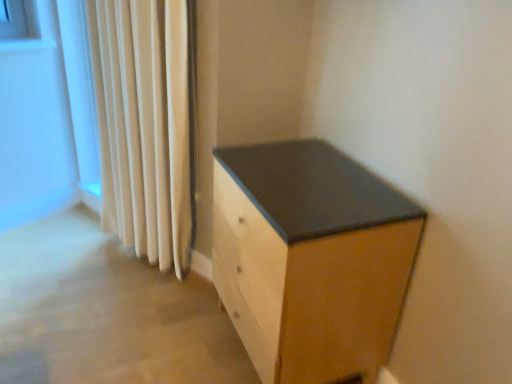
The image size is (512, 384). In order to click on beige fabric curtain at left in this screenshot , I will do 145,125.

This screenshot has width=512, height=384. What do you see at coordinates (145, 125) in the screenshot?
I see `beige fabric curtain at left` at bounding box center [145, 125].

In order to face matte black drawer at center, should I rotate leftwards or rightwards?

You should rotate right by 5.571 degrees.

The height and width of the screenshot is (384, 512). I want to click on matte black drawer at center, so point(311,259).

What do you see at coordinates (311, 259) in the screenshot? I see `matte black drawer at center` at bounding box center [311, 259].

Find the location of a particular element. The height and width of the screenshot is (384, 512). beige fabric curtain at left is located at coordinates (145, 125).

Does beige fabric curtain at left appear on the right side of matte black drawer at center?

In fact, beige fabric curtain at left is to the left of matte black drawer at center.

Between beige fabric curtain at left and matte black drawer at center, which one is positioned in front?

matte black drawer at center is closer to the camera.

Does point (139, 139) come in front of point (324, 167)?

No, it is not.

From the image's perspective, which one is positioned higher, beige fabric curtain at left or matte black drawer at center?

beige fabric curtain at left appears higher in the image.

From a real-world perspective, is beige fabric curtain at left positioned above or below matte black drawer at center?

beige fabric curtain at left is situated higher than matte black drawer at center in the real world.

Which of these two, beige fabric curtain at left or matte black drawer at center, is wider?

matte black drawer at center is wider.

Can you confirm if beige fabric curtain at left is taller than matte black drawer at center?

Yes.

Considering the relative sizes of beige fabric curtain at left and matte black drawer at center in the image provided, is beige fabric curtain at left bigger than matte black drawer at center?

Actually, beige fabric curtain at left might be smaller than matte black drawer at center.

Is matte black drawer at center inside beige fabric curtain at left?

No.

Looking at this image, are beige fabric curtain at left and matte black drawer at center making contact?

They are not placed beside each other.

Consider the image. Is beige fabric curtain at left positioned with its back to matte black drawer at center?

beige fabric curtain at left is not turned away from matte black drawer at center.

Can you tell me how much beige fabric curtain at left and matte black drawer at center differ in facing direction?

The angular difference between beige fabric curtain at left and matte black drawer at center is 27.6 degrees.

This screenshot has height=384, width=512. In order to click on curtain that appears above the matte black drawer at center (from a real-world perspective) in this screenshot , I will do `click(145, 125)`.

Considering the relative positions of matte black drawer at center and beige fabric curtain at left in the image provided, is matte black drawer at center to the left of beige fabric curtain at left from the viewer's perspective?

In fact, matte black drawer at center is to the right of beige fabric curtain at left.

Based on the photo, considering their positions, is matte black drawer at center located in front of or behind beige fabric curtain at left?

Clearly, matte black drawer at center is in front of beige fabric curtain at left.

Which is nearer, (371, 280) or (125, 136)?

Point (371, 280) is positioned closer to the camera compared to point (125, 136).

From the image's perspective, is matte black drawer at center above or below beige fabric curtain at left?

matte black drawer at center is below beige fabric curtain at left.

From a real-world perspective, does matte black drawer at center stand above beige fabric curtain at left?

No.

Looking at their sizes, would you say matte black drawer at center is wider or thinner than beige fabric curtain at left?

Clearly, matte black drawer at center has more width compared to beige fabric curtain at left.

Considering the relative sizes of matte black drawer at center and beige fabric curtain at left in the image provided, is matte black drawer at center shorter than beige fabric curtain at left?

Correct, matte black drawer at center is not as tall as beige fabric curtain at left.

Considering the relative sizes of matte black drawer at center and beige fabric curtain at left in the image provided, is matte black drawer at center bigger than beige fabric curtain at left?

Yes.

Can beige fabric curtain at left be found inside matte black drawer at center?

No, beige fabric curtain at left is not inside matte black drawer at center.

Is matte black drawer at center far away from beige fabric curtain at left?

They are positioned close to each other.

Could you tell me if matte black drawer at center is facing beige fabric curtain at left?

No, matte black drawer at center is not oriented towards beige fabric curtain at left.

How many degrees apart are the facing directions of matte black drawer at center and beige fabric curtain at left?

The angular difference between matte black drawer at center and beige fabric curtain at left is 27.6 degrees.

How far apart are matte black drawer at center and beige fabric curtain at left?

A distance of 29.97 inches exists between matte black drawer at center and beige fabric curtain at left.

Image resolution: width=512 pixels, height=384 pixels. I want to click on curtain above the matte black drawer at center (from the image's perspective), so click(145, 125).

Identify the location of curtain that appears above the matte black drawer at center (from the image's perspective). The image size is (512, 384). (145, 125).

This screenshot has height=384, width=512. I want to click on curtain behind the matte black drawer at center, so click(x=145, y=125).